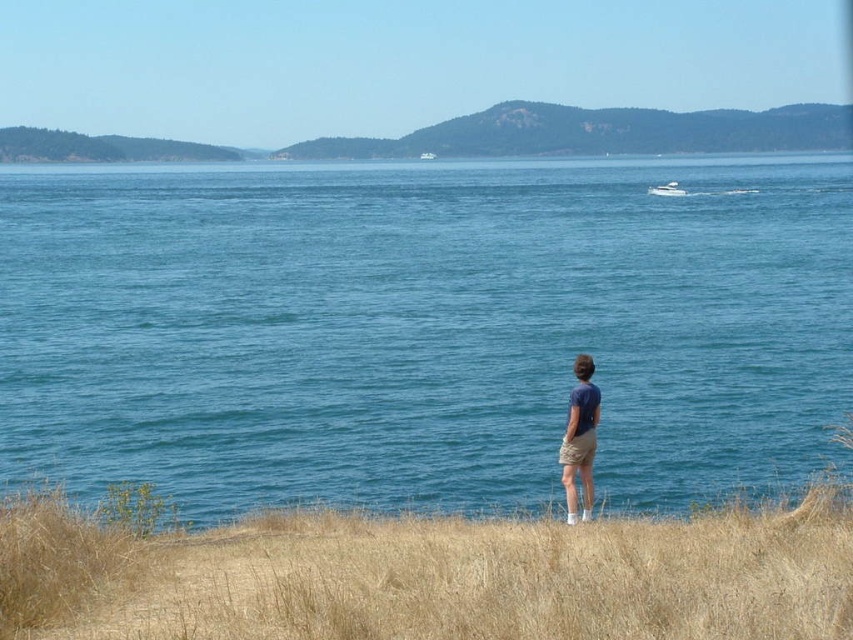
Question: Based on their relative distances, which object is farther from the blue water at center?

Choices:
 (A) green grassy hillside at upper center
 (B) dry grass at lower center
 (C) khaki cotton shorts at lower center
 (D) blue cotton shirt at center

Answer: (A)

Question: Can you confirm if dry grass at lower center is bigger than white glossy boat at upper right?

Choices:
 (A) no
 (B) yes

Answer: (A)

Question: Does dry grass at lower center lie behind khaki cotton shorts at lower center?

Choices:
 (A) no
 (B) yes

Answer: (A)

Question: Does dry grass at lower center appear over blue cotton shirt at center?

Choices:
 (A) yes
 (B) no

Answer: (B)

Question: Which object is farther from the camera taking this photo?

Choices:
 (A) white glossy boat at upper right
 (B) blue water at center
 (C) green grassy hillside at upper center
 (D) dry grass at lower center

Answer: (C)

Question: Which point is farther to the camera?

Choices:
 (A) 572,460
 (B) 483,392
 (C) 676,184
 (D) 721,605

Answer: (C)